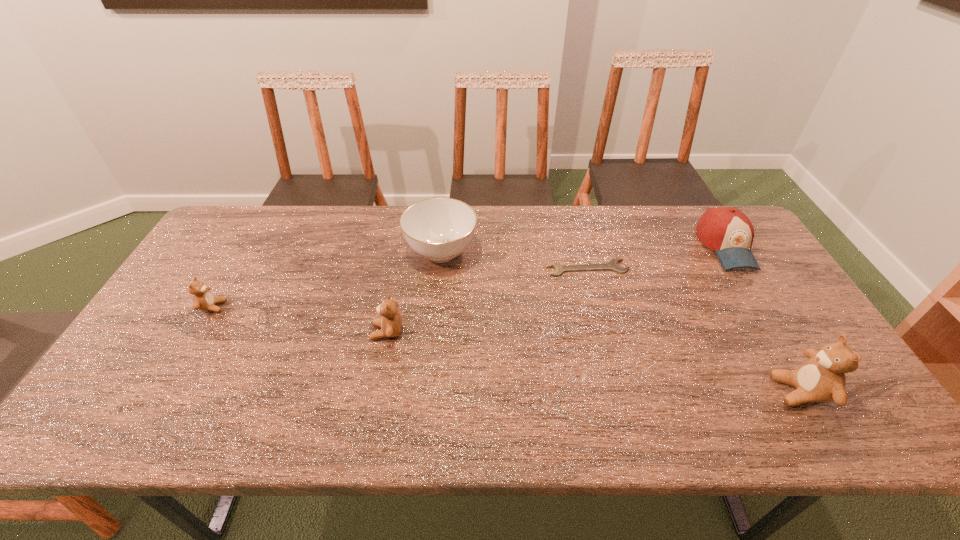
I want to click on vacant region located on the front-facing side of the second shortest teddy bear, so click(284, 332).

Identify the location of vacant area located 0.110m on the front-facing side of the second shortest teddy bear. This screenshot has width=960, height=540. (329, 332).

Find the location of `vacant space situated on the front-facing side of the second shortest teddy bear`. vacant space situated on the front-facing side of the second shortest teddy bear is located at coordinates (314, 332).

What are the coordinates of `free spot located on the front-facing side of the tallest teddy bear` in the screenshot? It's located at (634, 391).

The height and width of the screenshot is (540, 960). Find the location of `vacant space located 0.400m on the front-facing side of the tallest teddy bear`. vacant space located 0.400m on the front-facing side of the tallest teddy bear is located at coordinates (603, 391).

You are a GUI agent. You are given a task and a screenshot of the screen. Output one action in this format:
    pyautogui.click(x=<x>, y=<y>)
    Task: Click on the free space located on the front-facing side of the tallest teddy bear
    The width and height of the screenshot is (960, 540).
    Given the screenshot: What is the action you would take?
    pyautogui.click(x=693, y=391)

This screenshot has width=960, height=540. Identify the location of free location located 0.350m on the front of the chinaware. (429, 378).

Where is `free space located 0.360m on the front-facing side of the baseball cap`? This screenshot has width=960, height=540. free space located 0.360m on the front-facing side of the baseball cap is located at coordinates (806, 377).

This screenshot has height=540, width=960. Find the location of `vacant area situated on the right of the fourth object from left to right`. vacant area situated on the right of the fourth object from left to right is located at coordinates (672, 268).

Where is `chinaware present at the far edge`? The image size is (960, 540). chinaware present at the far edge is located at coordinates (439, 229).